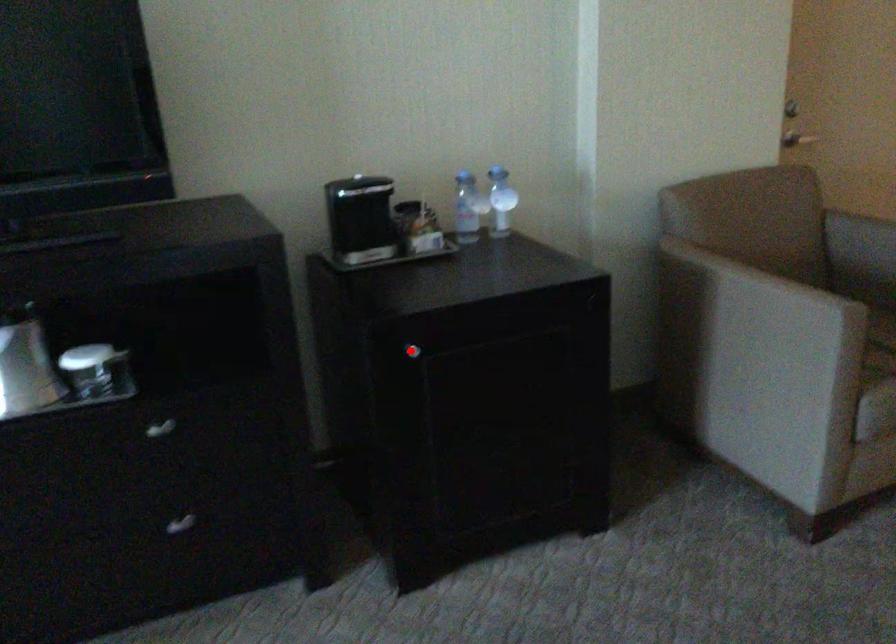
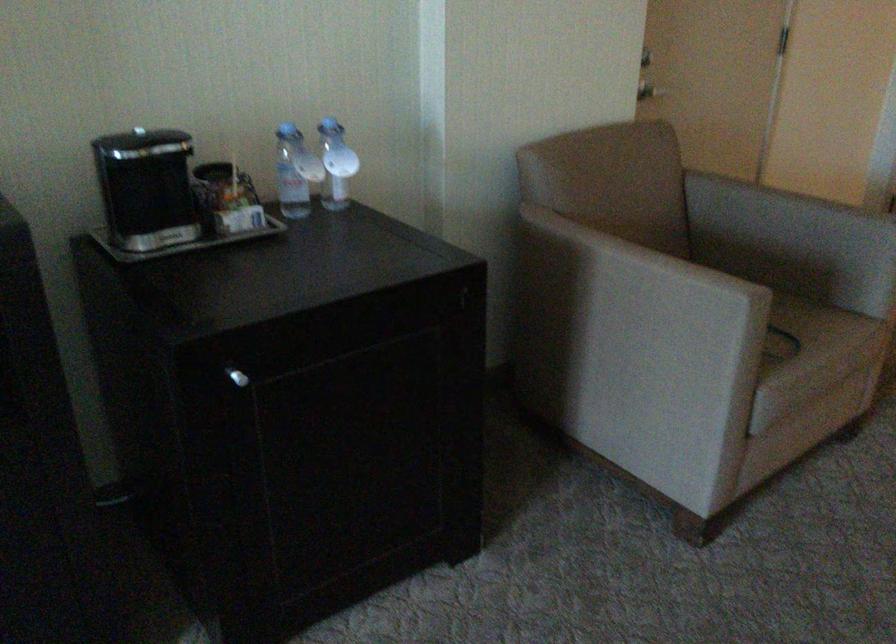
Where in the second image is the point corresponding to the highlighted location from the first image?

(237, 377)